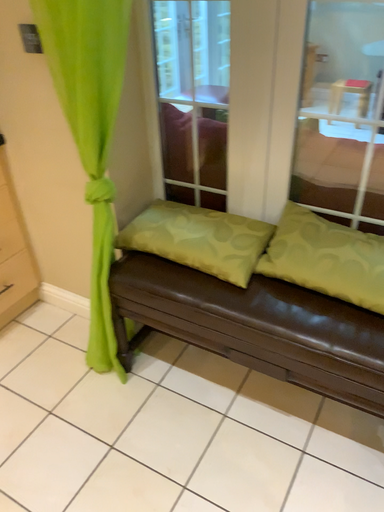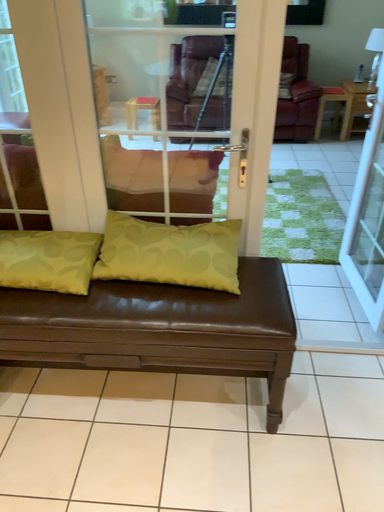
Question: How did the camera likely rotate when shooting the video?

Choices:
 (A) rotated left
 (B) rotated right

Answer: (B)